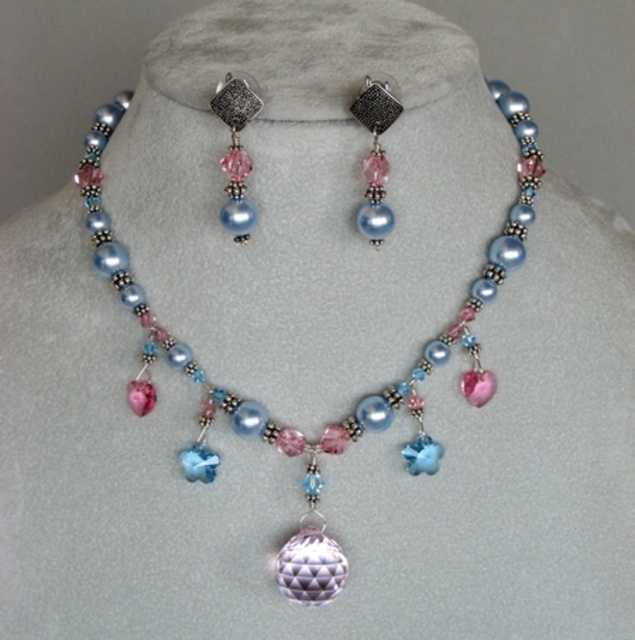
Between pearl-like pendant at upper center and satin silver pendant at upper center, which one is positioned lower?

satin silver pendant at upper center is lower down.

Can you confirm if pearl-like pendant at upper center is wider than satin silver pendant at upper center?

No, pearl-like pendant at upper center is not wider than satin silver pendant at upper center.

This screenshot has width=635, height=640. I want to click on pearl-like pendant at upper center, so click(x=236, y=152).

Is pearl-like beads at center wider than pearl-like pendant at upper center?

Indeed, pearl-like beads at center has a greater width compared to pearl-like pendant at upper center.

Can you confirm if pearl-like beads at center is positioned above pearl-like pendant at upper center?

Actually, pearl-like beads at center is below pearl-like pendant at upper center.

Image resolution: width=635 pixels, height=640 pixels. Identify the location of pearl-like beads at center. (x=358, y=401).

At what (x,y) coordinates should I click in order to perform the action: click on pearl-like beads at center. Please return your answer as a coordinate pair (x, y). The width and height of the screenshot is (635, 640). Looking at the image, I should click on (358, 401).

Which is below, pearl-like beads at center or satin silver pendant at upper center?

pearl-like beads at center is below.

Is the position of pearl-like beads at center less distant than that of satin silver pendant at upper center?

No, it is not.

Does point (295, 593) come behind point (373, 182)?

No, it is in front of (373, 182).

Where is `pearl-like beads at center`? Image resolution: width=635 pixels, height=640 pixels. pearl-like beads at center is located at coordinates (358, 401).